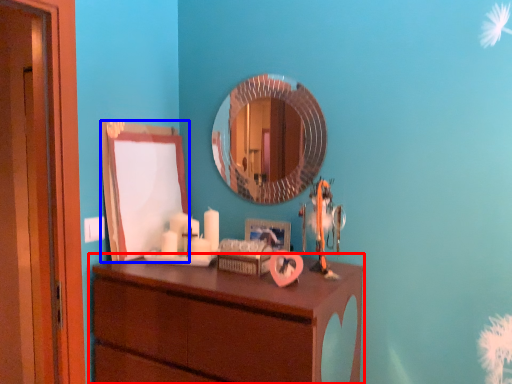
Question: Which of the following is the closest to the observer, chest of drawers (highlighted by a red box) or mirror (highlighted by a blue box)?

Choices:
 (A) chest of drawers
 (B) mirror

Answer: (A)